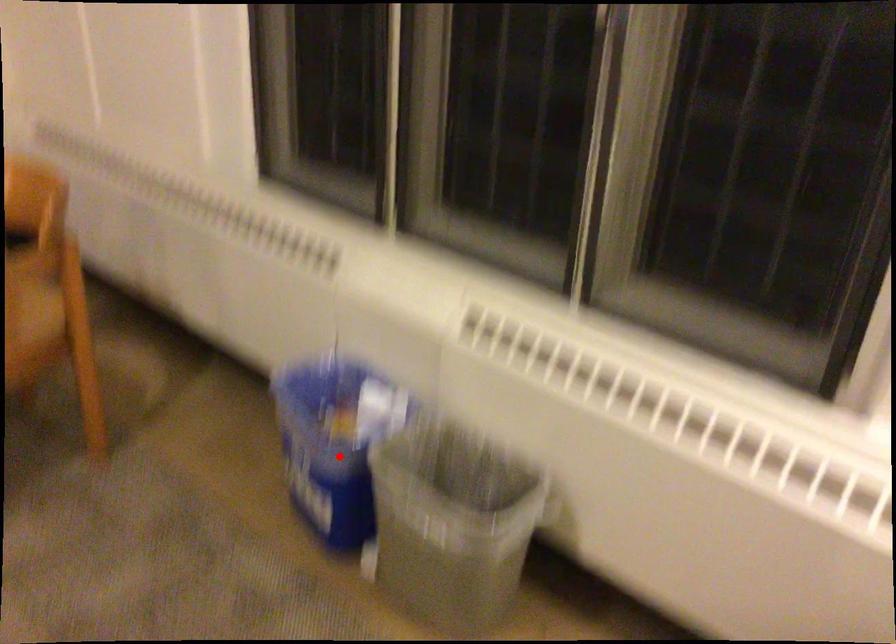
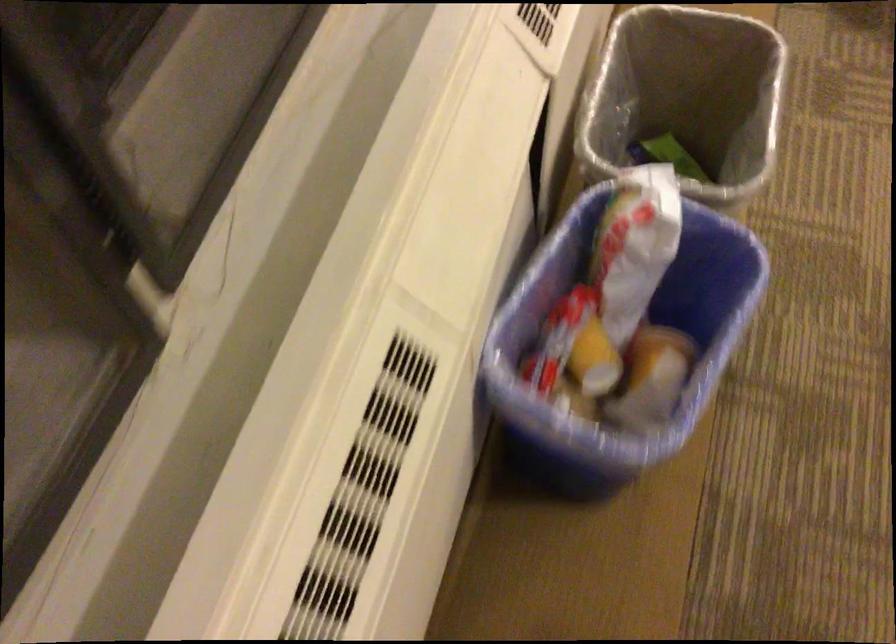
Find the pixel in the second image that matches the highlighted location in the first image.

(621, 343)